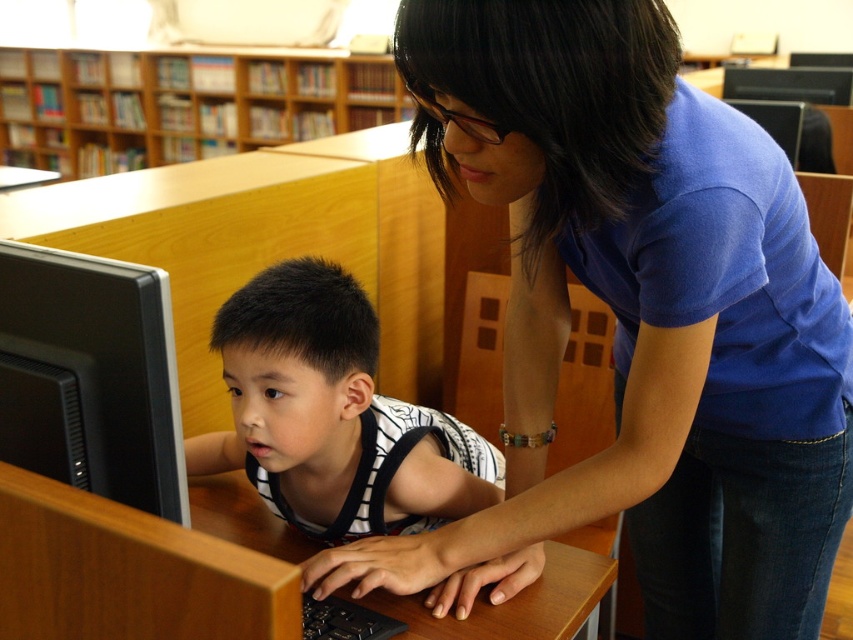
You are a delivery person who needs to place a new monitor that is 26 inches wide onto the desk in the image. The current monitor is the black plastic monitor at lower left. Can the new monitor fit in the same space without moving any other items?

The black plastic monitor at lower left is 26.19 inches from the camera. Since the new monitor is 26 inches wide, it should fit in the same space as the current monitor, as it is slightly narrower.

You are a photographer taking a picture of the scene. You notice two points in the image labeled as point (45, 371) and point (84, 104). Which point will appear larger in the photo?

Point (45, 371) is closer to the camera than point (84, 104), so it will appear larger in the photo.